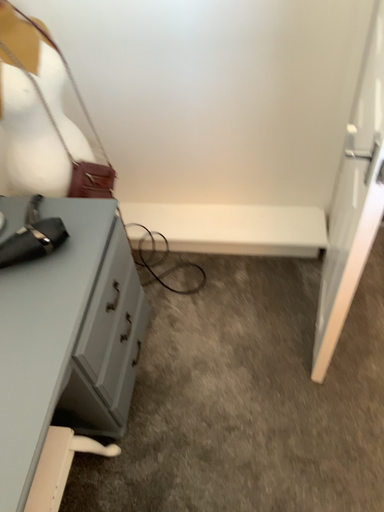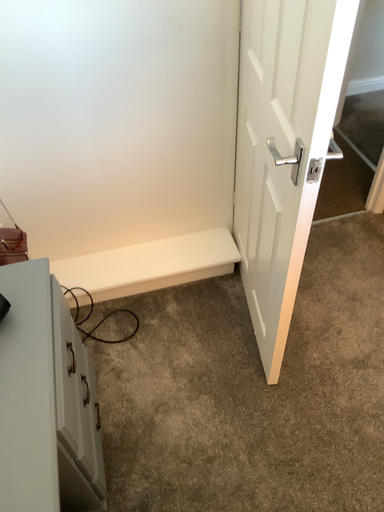
Question: How did the camera likely rotate when shooting the video?

Choices:
 (A) rotated upward
 (B) rotated downward

Answer: (A)